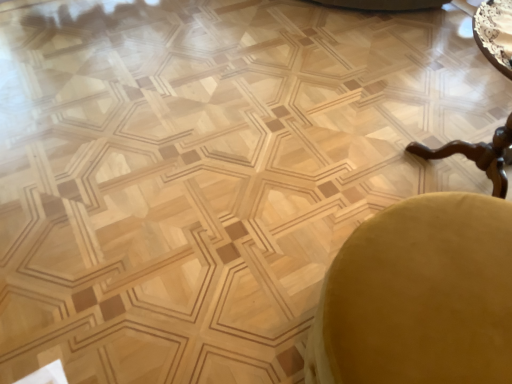
Question: Is velvet yellow swivel chair at lower right a part of wooden polished table at right?

Choices:
 (A) no
 (B) yes

Answer: (A)

Question: Would you say wooden polished table at right is a long distance from velvet yellow swivel chair at lower right?

Choices:
 (A) yes
 (B) no

Answer: (B)

Question: Is wooden polished table at right wider than velvet yellow swivel chair at lower right?

Choices:
 (A) yes
 (B) no

Answer: (A)

Question: Is wooden polished table at right thinner than velvet yellow swivel chair at lower right?

Choices:
 (A) yes
 (B) no

Answer: (B)

Question: From the image's perspective, would you say wooden polished table at right is shown under velvet yellow swivel chair at lower right?

Choices:
 (A) no
 (B) yes

Answer: (A)

Question: From a real-world perspective, is wooden polished table at right on top of velvet yellow swivel chair at lower right?

Choices:
 (A) no
 (B) yes

Answer: (B)

Question: Is velvet yellow swivel chair at lower right smaller than wooden polished table at right?

Choices:
 (A) yes
 (B) no

Answer: (A)

Question: Can wooden polished table at right be found inside velvet yellow swivel chair at lower right?

Choices:
 (A) yes
 (B) no

Answer: (B)

Question: Would you consider velvet yellow swivel chair at lower right to be distant from wooden polished table at right?

Choices:
 (A) no
 (B) yes

Answer: (A)

Question: From a real-world perspective, is velvet yellow swivel chair at lower right beneath wooden polished table at right?

Choices:
 (A) no
 (B) yes

Answer: (B)

Question: Considering the relative sizes of velvet yellow swivel chair at lower right and wooden polished table at right in the image provided, is velvet yellow swivel chair at lower right thinner than wooden polished table at right?

Choices:
 (A) no
 (B) yes

Answer: (B)

Question: Can you confirm if velvet yellow swivel chair at lower right is taller than wooden polished table at right?

Choices:
 (A) no
 (B) yes

Answer: (A)

Question: Is velvet yellow swivel chair at lower right taller or shorter than wooden polished table at right?

Choices:
 (A) tall
 (B) short

Answer: (B)